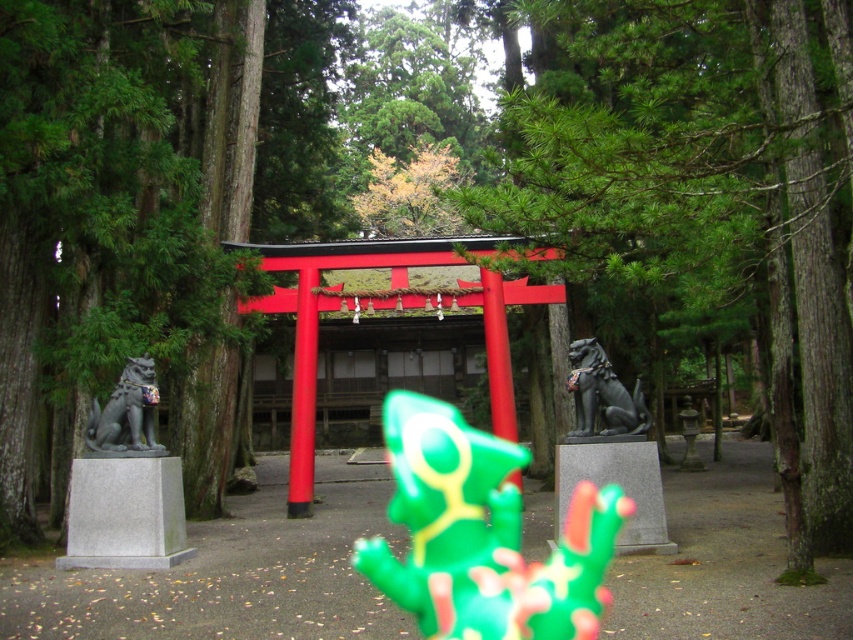
Is point (813, 186) farther from viewer compared to point (141, 426)?

No, it is not.

Is green leafy tree at center below gray stone dog at left?

Actually, green leafy tree at center is above gray stone dog at left.

Is point (828, 138) positioned after point (157, 449)?

No, (828, 138) is closer to viewer.

Find the location of `green leafy tree at center`. green leafy tree at center is located at coordinates (705, 202).

Does green rubber frog at center have a lesser height compared to gray stone dog at left?

No.

Who is higher up, green rubber frog at center or gray stone dog at left?

gray stone dog at left is higher up.

Identify the location of green rubber frog at center. The width and height of the screenshot is (853, 640). (482, 534).

How far apart are green leafy tree at center and green rubber frog at center?

green leafy tree at center and green rubber frog at center are 15.81 feet apart.

The width and height of the screenshot is (853, 640). What do you see at coordinates (705, 202) in the screenshot? I see `green leafy tree at center` at bounding box center [705, 202].

Which is in front, point (811, 93) or point (502, 602)?

Point (502, 602)

The width and height of the screenshot is (853, 640). In order to click on green leafy tree at center in this screenshot , I will do `click(705, 202)`.